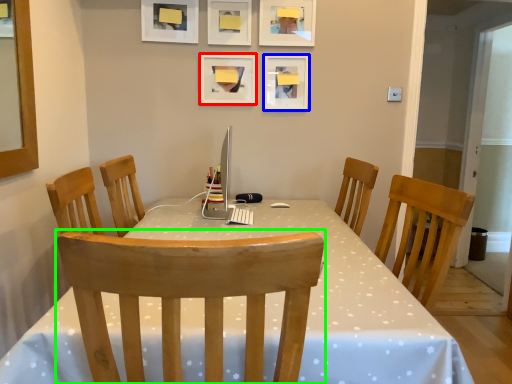
Question: Which object is the farthest from picture frame (highlighted by a red box)? Choose among these: picture frame (highlighted by a blue box) or chair (highlighted by a green box).

Choices:
 (A) picture frame
 (B) chair

Answer: (B)